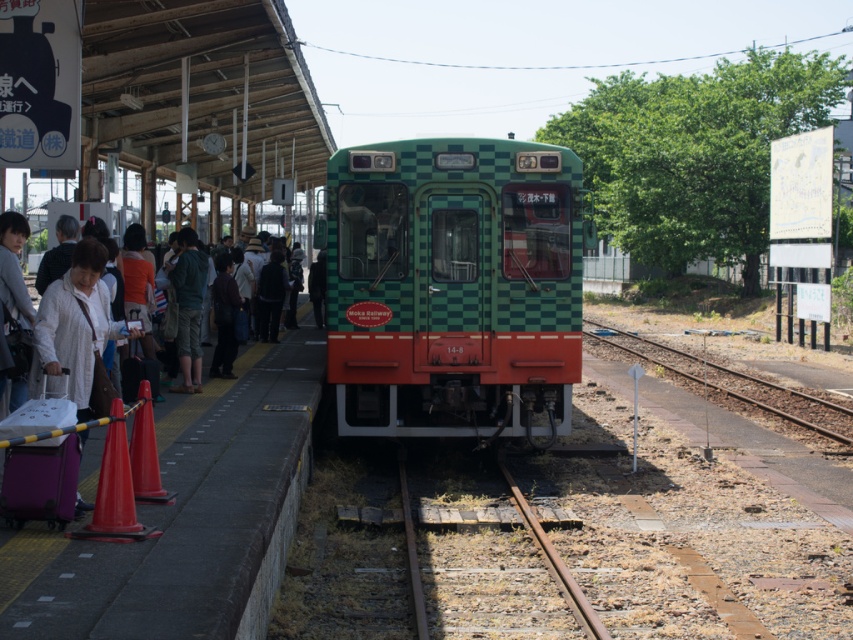
You are a passenger at the train station and need to board the green checkered train at center. The rusty metal train track at center is the only path to the train. Is the track wide enough for you to walk safely to the train?

The green checkered train at center is bigger than the rusty metal train track at center, so the track might not be wide enough for safe passage. However, since train tracks are typically designed for trains, the track width is sufficient for a person to walk safely to the train.

You are standing at the train station and want to reach the point marked at coordinates (573, 200). If you can walk 1.5 meters per second, how many seconds will it take you to reach that point?

The point marked at coordinates (573, 200) is 9.67 meters away from you. At a walking speed of 1.5 meters per second, it would take approximately 6.45 seconds to reach the point.

You are standing at the entrance of the train station and see the green checkered train at center. If you want to board the train, which direction should you walk towards?

The green checkered train at center is located at point [454,285], so you should walk towards the center of the station to board the train.